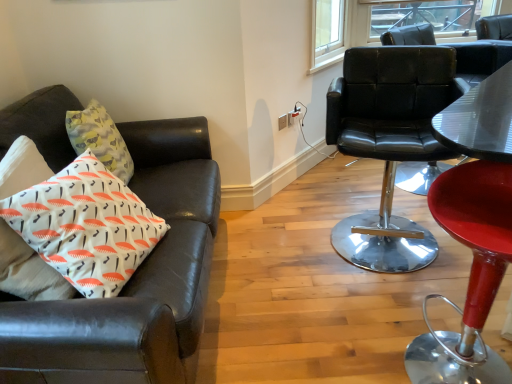
What do you see at coordinates (132, 279) in the screenshot? The image size is (512, 384). I see `leather couch at left, acting as the 1th chair starting from the left` at bounding box center [132, 279].

Describe the element at coordinates (283, 121) in the screenshot. I see `white plastic power outlet at upper center` at that location.

Describe the element at coordinates (85, 226) in the screenshot. This screenshot has width=512, height=384. I see `white printed cushion at left` at that location.

Locate an element on the screen. This screenshot has width=512, height=384. leather couch at left, arranged as the third chair when viewed from the right is located at coordinates (132, 279).

In terms of width, does clear glass window at upper right look wider or thinner when compared to black leather chair at right, marked as the 2th chair in a right-to-left arrangement?

Clearly, clear glass window at upper right has less width compared to black leather chair at right, marked as the 2th chair in a right-to-left arrangement.

The height and width of the screenshot is (384, 512). I want to click on window positioned vertically above the black leather chair at right, marked as the 2th chair in a right-to-left arrangement (from a real-world perspective), so click(390, 22).

Can you confirm if clear glass window at upper right is smaller than black leather chair at right, which is the second chair in left-to-right order?

Correct, clear glass window at upper right occupies less space than black leather chair at right, which is the second chair in left-to-right order.

From their relative heights in the image, would you say clear glass window at upper right is taller or shorter than black leather chair at right, marked as the 2th chair in a right-to-left arrangement?

clear glass window at upper right is shorter than black leather chair at right, marked as the 2th chair in a right-to-left arrangement.

Is black leather chair at right, marked as the 2th chair in a right-to-left arrangement, facing away from leather couch at left, acting as the 1th chair starting from the left?

That's not correct — black leather chair at right, marked as the 2th chair in a right-to-left arrangement, is not looking away from leather couch at left, acting as the 1th chair starting from the left.

Considering their positions, is black leather chair at right, marked as the 2th chair in a right-to-left arrangement, located in front of or behind leather couch at left, arranged as the third chair when viewed from the right?

In the image, black leather chair at right, marked as the 2th chair in a right-to-left arrangement, appears behind leather couch at left, arranged as the third chair when viewed from the right.

Does red leather bar stool at right, which appears as the 3th chair when viewed from the left, turn towards leather couch at left, acting as the 1th chair starting from the left?

No, red leather bar stool at right, which appears as the 3th chair when viewed from the left, does not turn towards leather couch at left, acting as the 1th chair starting from the left.

Can you see red leather bar stool at right, which appears as the 3th chair when viewed from the left, touching leather couch at left, acting as the 1th chair starting from the left?

No.

From the image's perspective, relative to leather couch at left, acting as the 1th chair starting from the left, is red leather bar stool at right, which appears as the 3th chair when viewed from the left, above or below?

red leather bar stool at right, which appears as the 3th chair when viewed from the left, is below leather couch at left, acting as the 1th chair starting from the left.

Considering the sizes of objects red leather bar stool at right, the first chair in the right-to-left sequence, and leather couch at left, acting as the 1th chair starting from the left, in the image provided, who is bigger, red leather bar stool at right, the first chair in the right-to-left sequence, or leather couch at left, acting as the 1th chair starting from the left,?

leather couch at left, acting as the 1th chair starting from the left, is bigger.

In terms of width, does clear glass window at upper right look wider or thinner when compared to red leather bar stool at right, which appears as the 3th chair when viewed from the left?

Clearly, clear glass window at upper right has less width compared to red leather bar stool at right, which appears as the 3th chair when viewed from the left.

Does clear glass window at upper right have a larger size compared to red leather bar stool at right, the first chair in the right-to-left sequence?

Actually, clear glass window at upper right might be smaller than red leather bar stool at right, the first chair in the right-to-left sequence.

Is clear glass window at upper right turned away from red leather bar stool at right, which appears as the 3th chair when viewed from the left?

clear glass window at upper right does not have its back to red leather bar stool at right, which appears as the 3th chair when viewed from the left.

Considering the positions of objects clear glass window at upper right and red leather bar stool at right, the first chair in the right-to-left sequence, in the image provided, who is more to the right, clear glass window at upper right or red leather bar stool at right, the first chair in the right-to-left sequence,?

clear glass window at upper right.

Between red leather bar stool at right, the first chair in the right-to-left sequence, and black leather chair at right, which is the second chair in left-to-right order, which one appears on the right side from the viewer's perspective?

red leather bar stool at right, the first chair in the right-to-left sequence.

Considering the sizes of objects red leather bar stool at right, which appears as the 3th chair when viewed from the left, and black leather chair at right, marked as the 2th chair in a right-to-left arrangement, in the image provided, who is bigger, red leather bar stool at right, which appears as the 3th chair when viewed from the left, or black leather chair at right, marked as the 2th chair in a right-to-left arrangement,?

black leather chair at right, marked as the 2th chair in a right-to-left arrangement.

Who is shorter, red leather bar stool at right, the first chair in the right-to-left sequence, or black leather chair at right, marked as the 2th chair in a right-to-left arrangement?

red leather bar stool at right, the first chair in the right-to-left sequence.

This screenshot has height=384, width=512. What are the coordinates of `chair located on the right of black leather chair at right, which is the second chair in left-to-right order` in the screenshot? It's located at (470, 273).

Which point is more forward, (283,123) or (412,119)?

Point (412,119)

Is white plastic power outlet at upper center oriented away from black leather chair at right, marked as the 2th chair in a right-to-left arrangement?

white plastic power outlet at upper center is not turned away from black leather chair at right, marked as the 2th chair in a right-to-left arrangement.

Considering the sizes of objects white plastic power outlet at upper center and black leather chair at right, which is the second chair in left-to-right order, in the image provided, who is wider, white plastic power outlet at upper center or black leather chair at right, which is the second chair in left-to-right order,?

black leather chair at right, which is the second chair in left-to-right order, is wider.

Is white plastic power outlet at upper center not within black leather chair at right, marked as the 2th chair in a right-to-left arrangement?

Absolutely, white plastic power outlet at upper center is external to black leather chair at right, marked as the 2th chair in a right-to-left arrangement.

Considering the sizes of objects red leather bar stool at right, which appears as the 3th chair when viewed from the left, and white printed cushion at left in the image provided, who is thinner, red leather bar stool at right, which appears as the 3th chair when viewed from the left, or white printed cushion at left?

white printed cushion at left.

Considering the relative positions of red leather bar stool at right, the first chair in the right-to-left sequence, and white printed cushion at left in the image provided, is red leather bar stool at right, the first chair in the right-to-left sequence, to the right of white printed cushion at left from the viewer's perspective?

Yes.

In the scene shown: Could you measure the distance between red leather bar stool at right, which appears as the 3th chair when viewed from the left, and white printed cushion at left?

They are 1.08 meters apart.

Considering the sizes of objects red leather bar stool at right, which appears as the 3th chair when viewed from the left, and white printed cushion at left in the image provided, who is smaller, red leather bar stool at right, which appears as the 3th chair when viewed from the left, or white printed cushion at left?

Smaller between the two is white printed cushion at left.

The height and width of the screenshot is (384, 512). Find the location of `window that is on the right side of black leather chair at right, which is the second chair in left-to-right order`. window that is on the right side of black leather chair at right, which is the second chair in left-to-right order is located at coordinates 390,22.

From the image's perspective, which chair is the 1st one below the black leather chair at right, which is the second chair in left-to-right order? Please provide its 2D coordinates.

[(132, 279)]

When comparing their distances from red leather bar stool at right, which appears as the 3th chair when viewed from the left, does black leather chair at right, marked as the 2th chair in a right-to-left arrangement, or white plastic power outlet at upper center seem closer?

black leather chair at right, marked as the 2th chair in a right-to-left arrangement, is positioned closer to the anchor red leather bar stool at right, which appears as the 3th chair when viewed from the left.

From the image, which object appears to be farther from black leather chair at right, which is the second chair in left-to-right order, leather couch at left, acting as the 1th chair starting from the left, or white printed cushion at left?

Among the two, white printed cushion at left is located further to black leather chair at right, which is the second chair in left-to-right order.

From the picture: Based on their spatial positions, is black leather chair at right, which is the second chair in left-to-right order, or clear glass window at upper right further from leather couch at left, arranged as the third chair when viewed from the right?

clear glass window at upper right is positioned further to the anchor leather couch at left, arranged as the third chair when viewed from the right.

When comparing their distances from white printed cushion at left, does clear glass window at upper right or black leather chair at right, marked as the 2th chair in a right-to-left arrangement, seem closer?

black leather chair at right, marked as the 2th chair in a right-to-left arrangement, is positioned closer to the anchor white printed cushion at left.

Based on their spatial positions, is white printed cushion at left or red leather bar stool at right, the first chair in the right-to-left sequence, closer to clear glass window at upper right?

red leather bar stool at right, the first chair in the right-to-left sequence.

From the image, which object appears to be farther from white plastic power outlet at upper center, leather couch at left, arranged as the third chair when viewed from the right, or red leather bar stool at right, the first chair in the right-to-left sequence?

red leather bar stool at right, the first chair in the right-to-left sequence, is positioned further to the anchor white plastic power outlet at upper center.

When comparing their distances from black leather chair at right, which is the second chair in left-to-right order, does white plastic power outlet at upper center or red leather bar stool at right, which appears as the 3th chair when viewed from the left, seem further?

The object further to black leather chair at right, which is the second chair in left-to-right order, is white plastic power outlet at upper center.

Considering their positions, is clear glass window at upper right positioned closer to white printed cushion at left than red leather bar stool at right, which appears as the 3th chair when viewed from the left?

red leather bar stool at right, which appears as the 3th chair when viewed from the left, is positioned closer to the anchor white printed cushion at left.

This screenshot has height=384, width=512. Identify the location of power outlet between black leather chair at right, which is the second chair in left-to-right order, and clear glass window at upper right from front to back. (283, 121).

At what (x,y) coordinates should I click in order to perform the action: click on chair between red leather bar stool at right, which appears as the 3th chair when viewed from the left, and clear glass window at upper right in the front-back direction. Please return your answer as a coordinate pair (x, y). Looking at the image, I should click on (389, 143).

At what (x,y) coordinates should I click in order to perform the action: click on pillow positioned between red leather bar stool at right, the first chair in the right-to-left sequence, and clear glass window at upper right from near to far. Please return your answer as a coordinate pair (x, y). This screenshot has height=384, width=512. Looking at the image, I should click on (85, 226).

Find the location of `chair positioned between white printed cushion at left and clear glass window at upper right from near to far`. chair positioned between white printed cushion at left and clear glass window at upper right from near to far is located at coordinates pos(389,143).